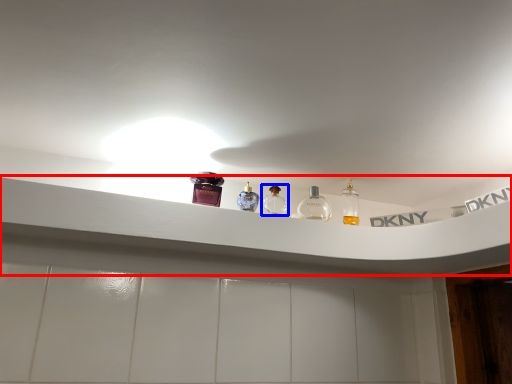
Question: Which of the following is the farthest to the observer, window sill (highlighted by a red box) or bottle (highlighted by a blue box)?

Choices:
 (A) window sill
 (B) bottle

Answer: (B)